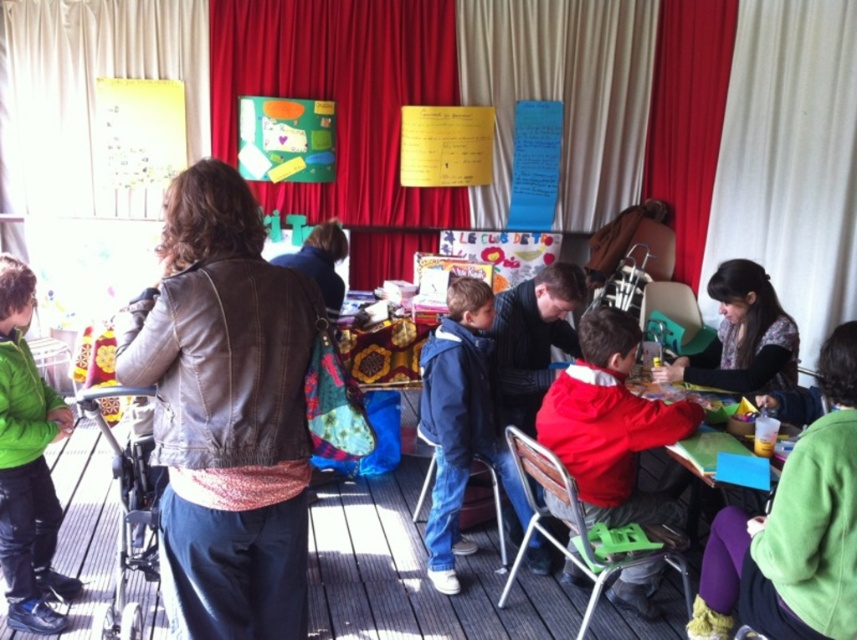
You are standing in the classroom and see a point marked at coordinates (794, 529). Which object is this point located on?

The point at coordinates (794, 529) is located on the green fleece jacket at lower right.

Based on the photo, you are standing at the entrance of the room and want to place a small plant between the wooden at center and the wooden chair at lower center. Based on their positions, where should you place the plant?

The wooden at center is located below the wooden chair at lower center, so you should place the plant between them in the space that is below the wooden chair at lower center and above the wooden at center.